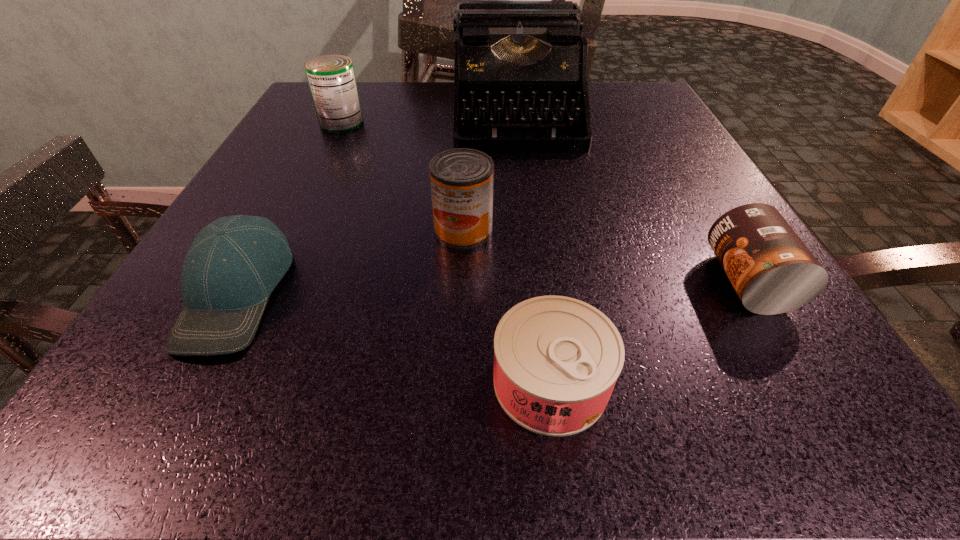
Where is `typewriter`? The image size is (960, 540). typewriter is located at coordinates (523, 61).

The image size is (960, 540). Identify the location of the farthest can. (331, 78).

Find the location of a particular element. This screenshot has width=960, height=540. the second farthest can is located at coordinates (461, 179).

This screenshot has width=960, height=540. What are the coordinates of `the rightmost object` in the screenshot? It's located at (772, 271).

Where is `the rightmost can`? Image resolution: width=960 pixels, height=540 pixels. the rightmost can is located at coordinates (772, 271).

Identify the location of baseball cap. Image resolution: width=960 pixels, height=540 pixels. (234, 263).

I want to click on the nearest can, so click(x=556, y=359).

The height and width of the screenshot is (540, 960). In order to click on vacant space situated 0.080m on the typing side of the tallest object in this screenshot , I will do `click(523, 177)`.

Find the location of a particular element. free space located on the front of the leftmost can is located at coordinates (276, 258).

Identify the location of vacant space positioned 0.370m on the back of the third nearest can. (468, 110).